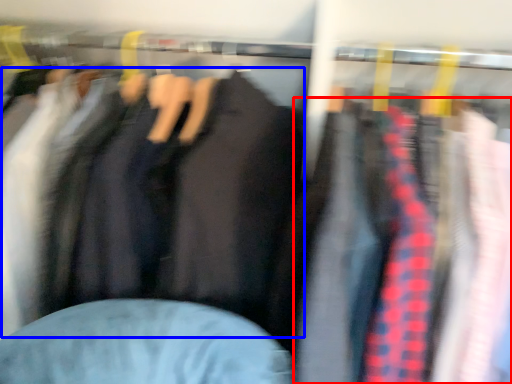
Question: Which object appears farthest to the camera in this image, clothing (highlighted by a red box) or jacket (highlighted by a blue box)?

Choices:
 (A) clothing
 (B) jacket

Answer: (B)